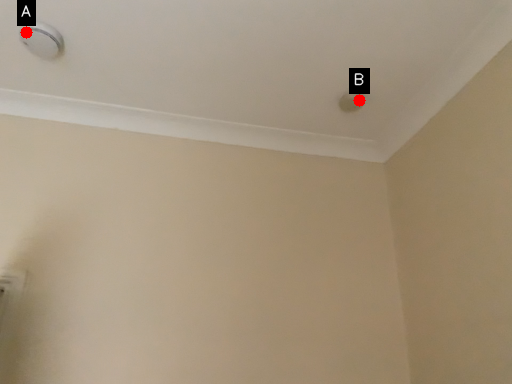
Question: Two points are circled on the image, labeled by A and B beside each circle. Which point is further to the camera?

Choices:
 (A) A is further
 (B) B is further

Answer: (B)